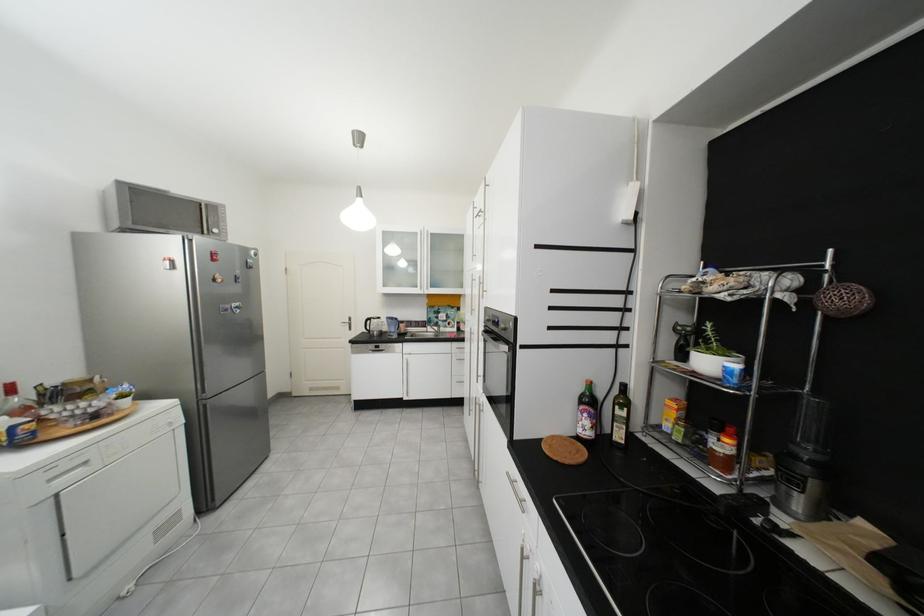
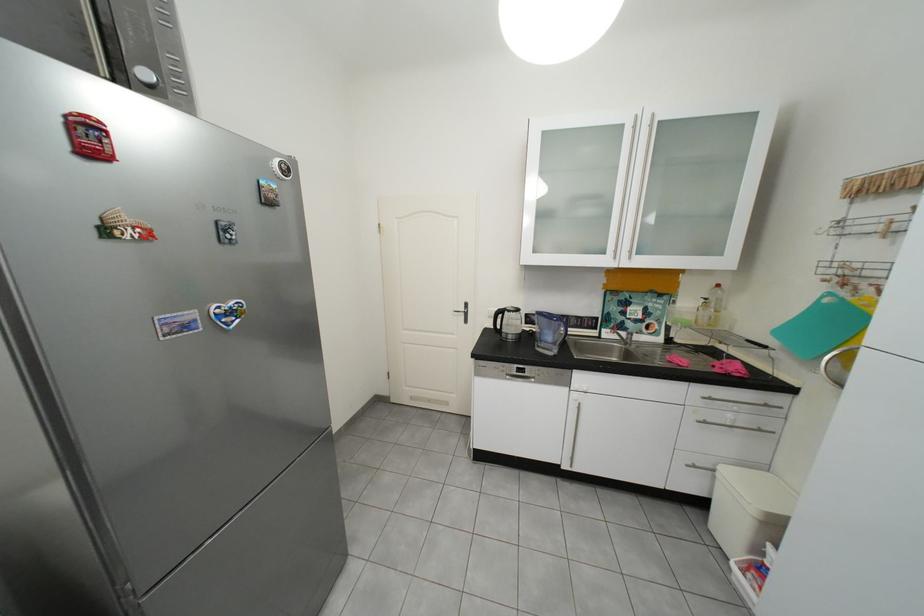
In the second image, find the point that corresponds to (441,330) in the first image.

(619, 334)